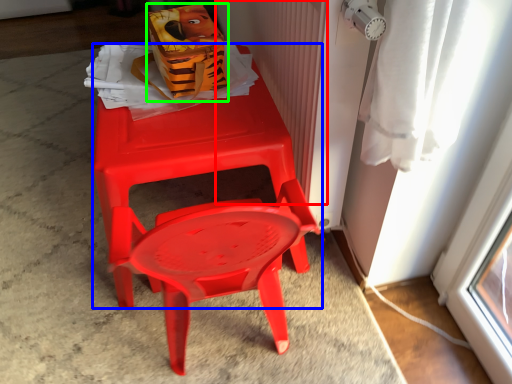
Question: Estimate the real-world distances between objects in this image. Which object is closer to radiator (highlighted by a red box), chair (highlighted by a blue box) or lunch box (highlighted by a green box)?

Choices:
 (A) chair
 (B) lunch box

Answer: (A)